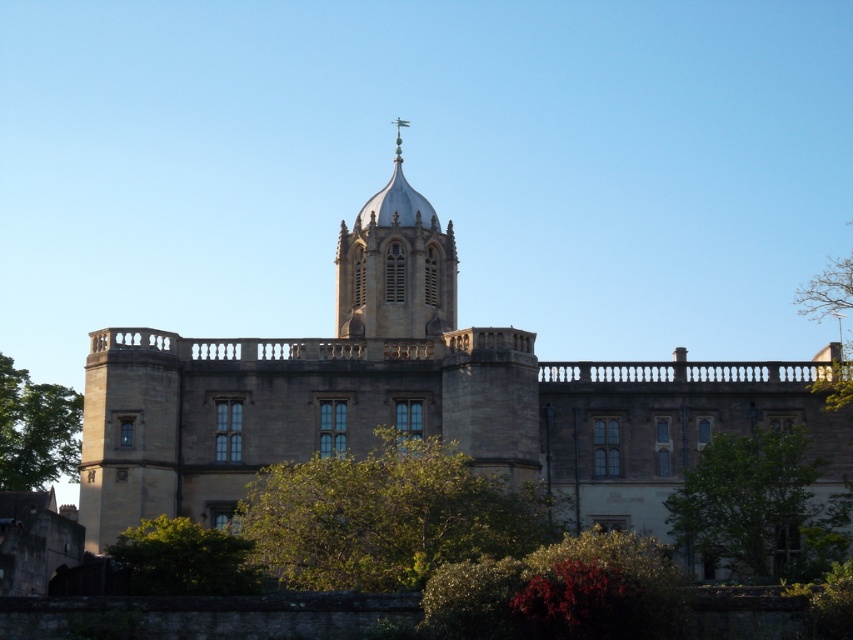
You are an architect analyzing the proportions of the brown stone church at center and the green leafy tree at upper right in the image. Which object occupies more horizontal space in the scene?

The brown stone church at center occupies more horizontal space than the green leafy tree at upper right because its width surpasses the tree.

You are standing in front of a historic building and want to know how far you are from the point marked at coordinates (395, 301). Can you determine the distance?

You are 110.24 meters away from the point marked at coordinates (395, 301).